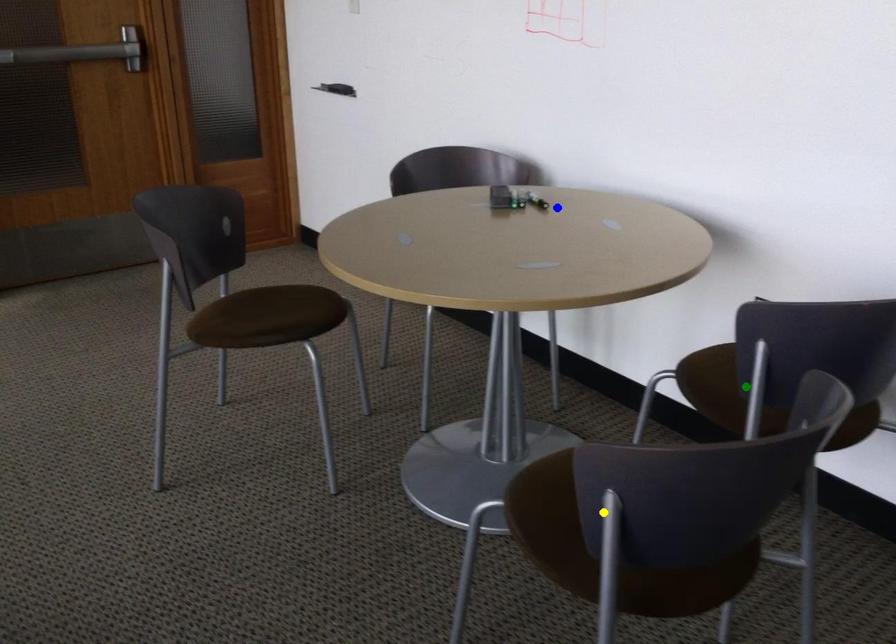
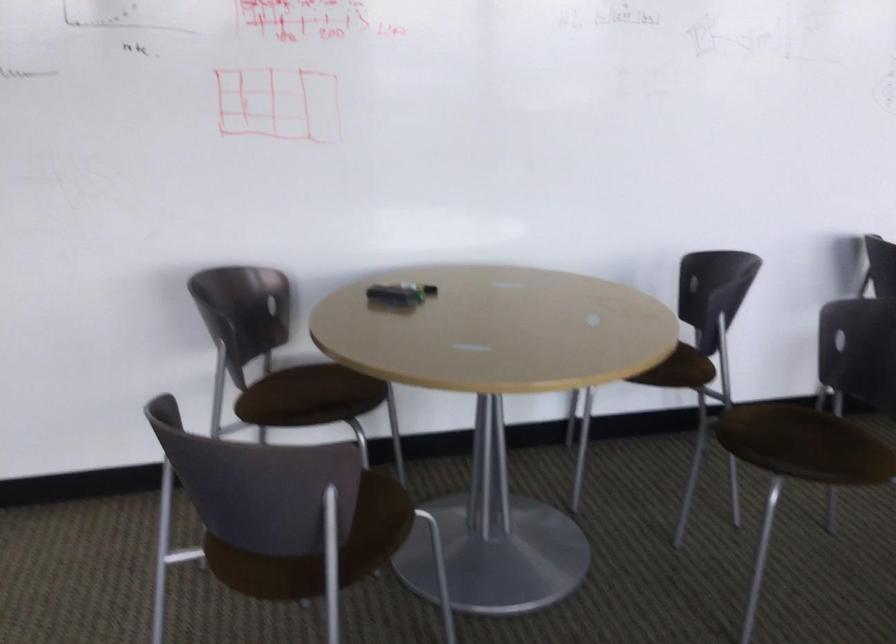
I am providing you with two images of the same scene from different viewpoints. Three points are marked in image1. Which point corresponds to a part or object that is occluded in image2?In image1, three points are marked. Which of them correspond to a part or object that is occluded in image2?Among the three points shown in image1, which one corresponds to a part or object that is no longer visible due to occlusion in image2?

Invisible in image2: green point.